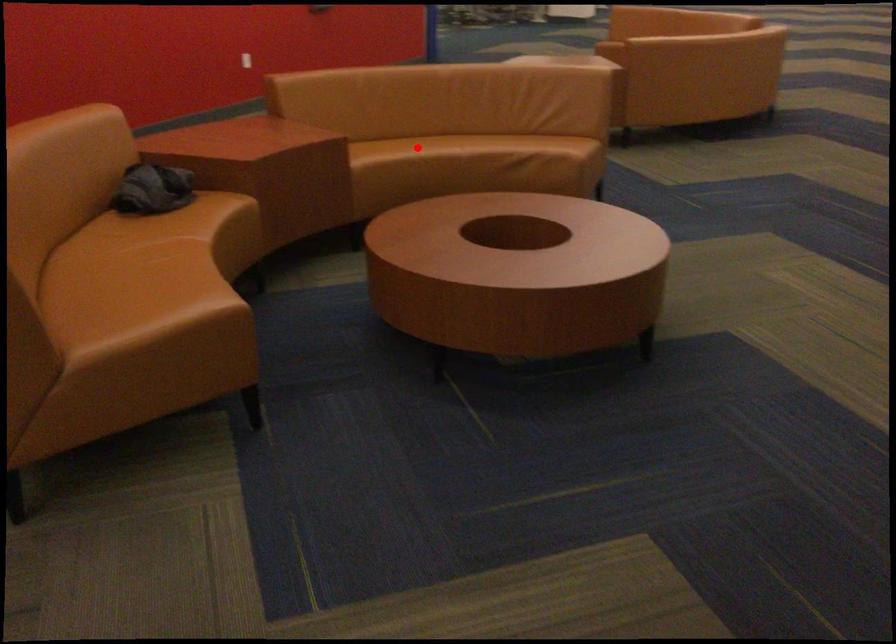
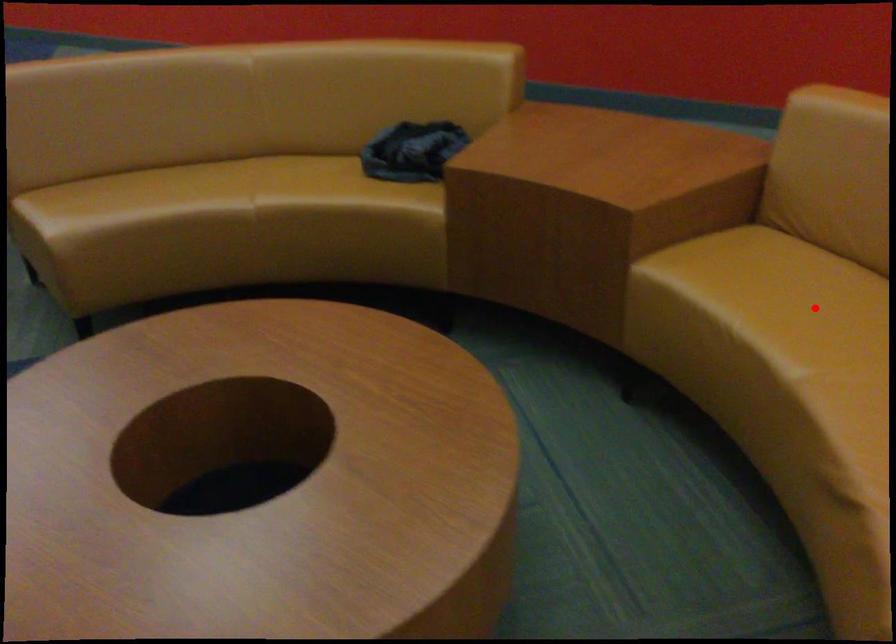
I am providing you with two images of the same scene from different viewpoints. A red point is marked on the first image and another point is marked on the second image. Does the point marked in image1 correspond to the same location as the one in image2?

Yes